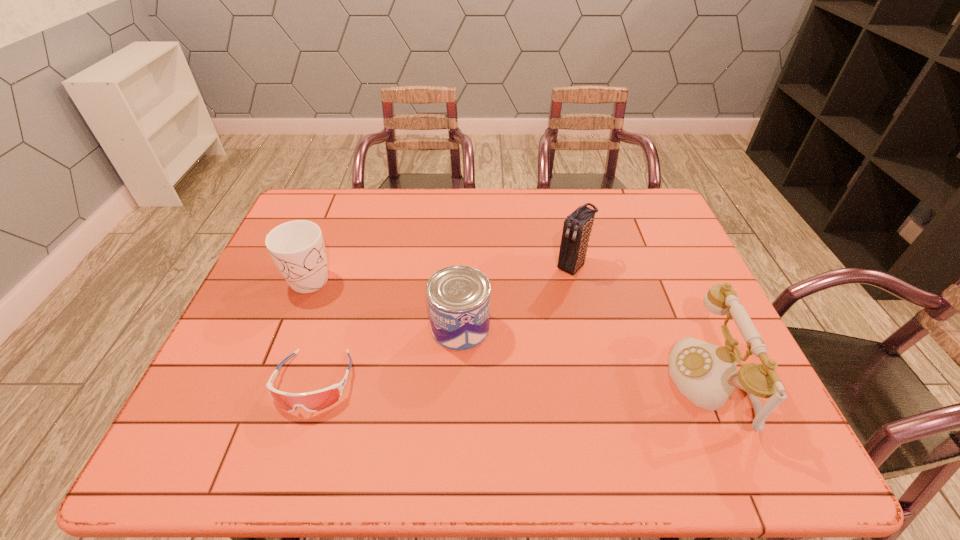
Locate an element on the screen. mug that is at the left edge is located at coordinates (297, 248).

I want to click on object positioned at the right edge, so click(x=706, y=374).

The image size is (960, 540). Identify the location of object located in the near left corner section of the desktop. (314, 401).

Where is `object located at the near right corner`? object located at the near right corner is located at coordinates (706, 374).

Where is `vacant region at the far edge of the desktop`? Image resolution: width=960 pixels, height=540 pixels. vacant region at the far edge of the desktop is located at coordinates (484, 198).

Where is `vacant region at the near edge`? The width and height of the screenshot is (960, 540). vacant region at the near edge is located at coordinates (606, 412).

This screenshot has width=960, height=540. In the image, there is a desktop. What are the coordinates of `vacant area at the left edge` in the screenshot? It's located at (276, 325).

Where is `vacant space at the right edge of the desktop`? The height and width of the screenshot is (540, 960). vacant space at the right edge of the desktop is located at coordinates (667, 335).

You are a GUI agent. You are given a task and a screenshot of the screen. Output one action in this format:
    pyautogui.click(x=<x>, y=<y>)
    Task: Click on the vacant area at the near left corner
    
    Given the screenshot: What is the action you would take?
    pyautogui.click(x=223, y=409)

Where is `free space between the rightmost object and the mug`? This screenshot has width=960, height=540. free space between the rightmost object and the mug is located at coordinates (506, 332).